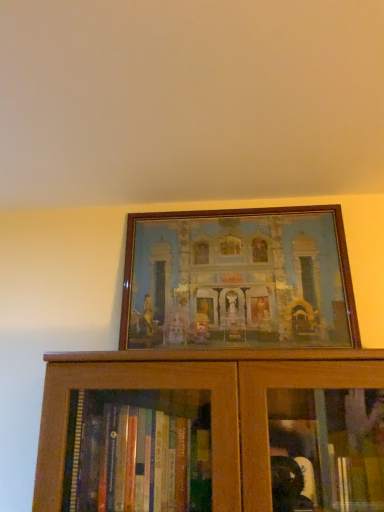
Identify the location of free spot above wooden picture frame at upper center (from a real-world perspective). (224, 209).